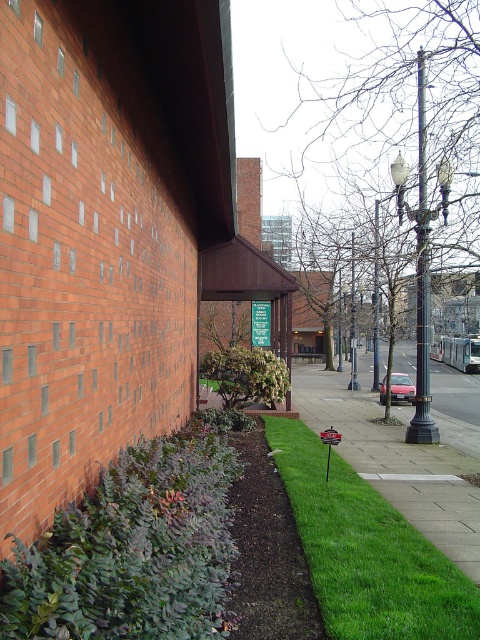
Question: From the image, what is the correct spatial relationship of black metal streetlamp at right in relation to green leafy bush at center?

Choices:
 (A) left
 (B) right

Answer: (B)

Question: Can you confirm if green grass at lower right is positioned to the left of green leafy bush at center?

Choices:
 (A) yes
 (B) no

Answer: (B)

Question: Which point is closer to the camera taking this photo?

Choices:
 (A) pyautogui.click(x=24, y=560)
 (B) pyautogui.click(x=338, y=468)

Answer: (A)

Question: Does green leafy bush at lower left have a lesser width compared to black metal streetlamp at right?

Choices:
 (A) yes
 (B) no

Answer: (A)

Question: Which of the following is the farthest from the observer?

Choices:
 (A) green leafy bush at center
 (B) black metal streetlamp at right

Answer: (A)

Question: Estimate the real-world distances between objects in this image. Which object is farther from the green leafy bush at lower left?

Choices:
 (A) black metal streetlamp at right
 (B) green leafy bush at center
 (C) green grass at lower right

Answer: (A)